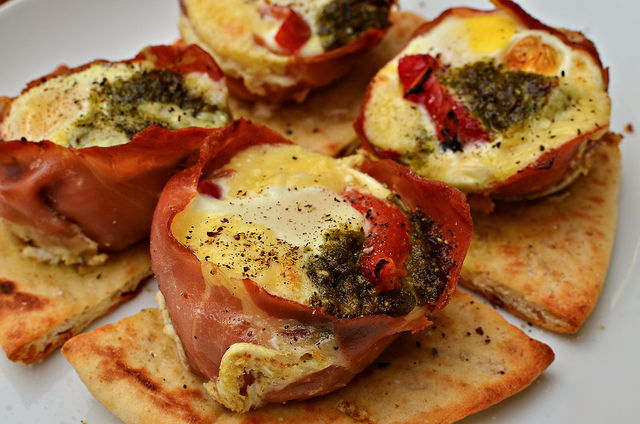
The height and width of the screenshot is (424, 640). I want to click on thin red cup, so (x=465, y=219), (x=548, y=172), (x=317, y=69), (x=97, y=167).